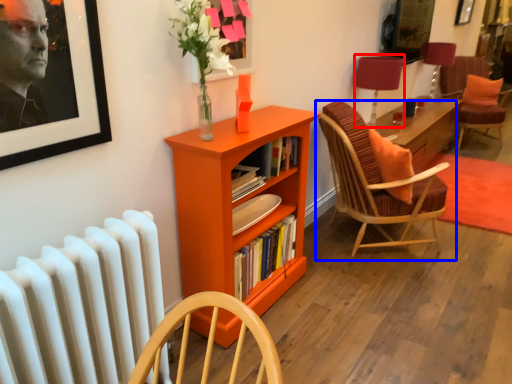
Question: Which point is further to the camera, table lamp (highlighted by a red box) or chair (highlighted by a blue box)?

Choices:
 (A) table lamp
 (B) chair

Answer: (A)